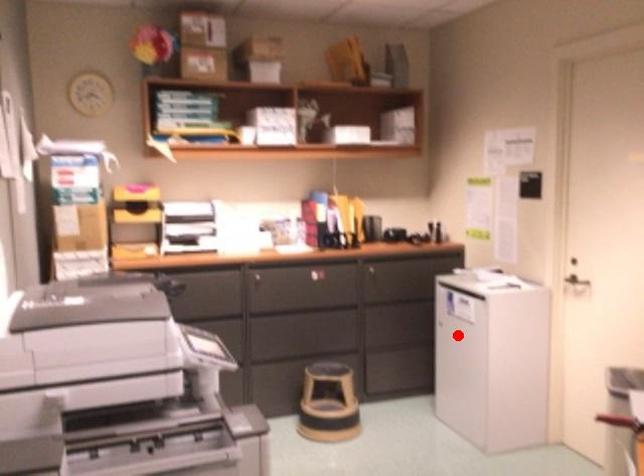
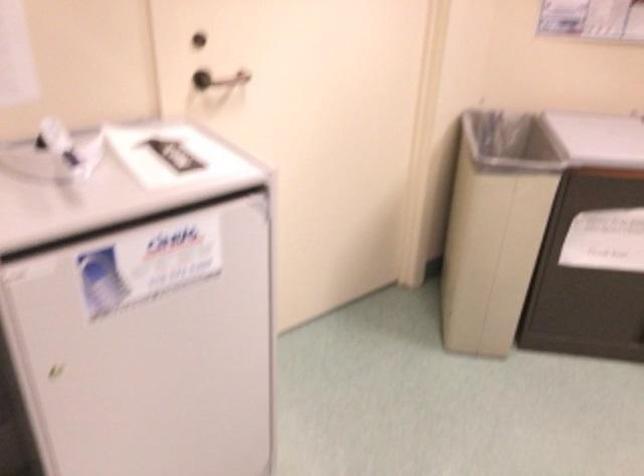
In the second image, find the point that corresponds to the highlighted location in the first image.

(146, 343)